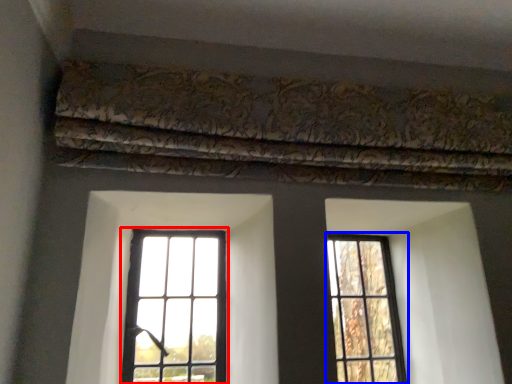
Question: Which object is closer to the camera taking this photo, window (highlighted by a red box) or window (highlighted by a blue box)?

Choices:
 (A) window
 (B) window

Answer: (A)